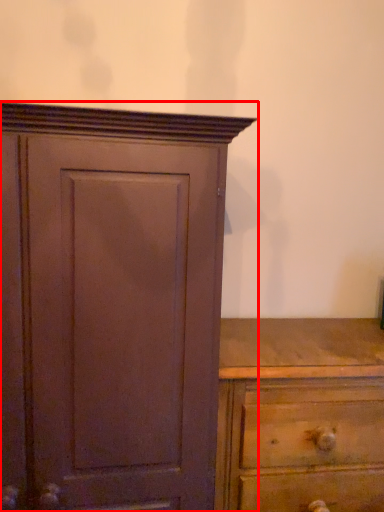
Question: From the image's perspective, what is the correct spatial relationship of cupboard (annotated by the red box) in relation to chest of drawers?

Choices:
 (A) above
 (B) below

Answer: (A)